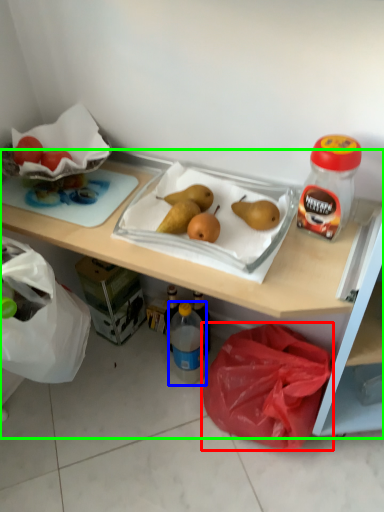
Question: Considering the real-world distances, which object is closest to plastic bag (highlighted by a red box)? bottle (highlighted by a blue box) or desk (highlighted by a green box).

Choices:
 (A) bottle
 (B) desk

Answer: (B)